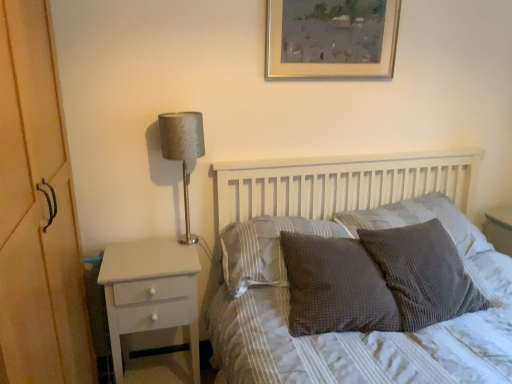
Question: From a real-world perspective, is satin silver lamp at left positioned above or below gold/golden frame at upper center?

Choices:
 (A) below
 (B) above

Answer: (A)

Question: In terms of width, does satin silver lamp at left look wider or thinner when compared to gold/golden frame at upper center?

Choices:
 (A) wide
 (B) thin

Answer: (A)

Question: Estimate the real-world distances between objects in this image. Which object is farther from the gold/golden frame at upper center?

Choices:
 (A) satin silver lamp at left
 (B) waffle-textured gray pillow at center-right, acting as the second pillow starting from the right
 (C) textured gray pillow at center, which is the 4th pillow in right-to-left order
 (D) textured gray pillow at center, marked as the 2th pillow in a left-to-right arrangement
 (E) white painted wood nightstand at left

Answer: (E)

Question: Which object is positioned farthest from the textured gray pillow at center, which is counted as the 1th pillow, starting from the left?

Choices:
 (A) gold/golden frame at upper center
 (B) textured gray pillow at center, marked as the 2th pillow in a left-to-right arrangement
 (C) white painted wood nightstand at left
 (D) textured gray pillow at center, which is counted as the fourth pillow, starting from the left
 (E) satin silver lamp at left

Answer: (A)